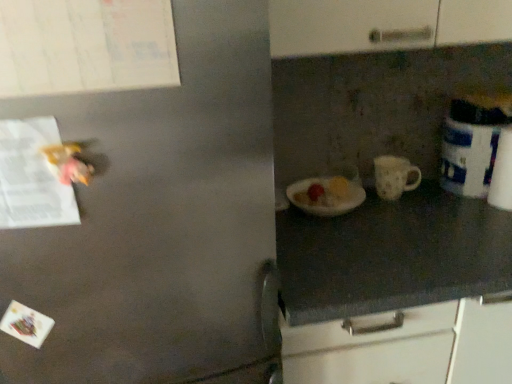
Question: From a real-world perspective, is white matte mug at center above or below white paper at left?

Choices:
 (A) below
 (B) above

Answer: (A)

Question: Does point (380, 195) appear closer or farther from the camera than point (0, 190)?

Choices:
 (A) closer
 (B) farther

Answer: (B)

Question: Which is nearer to the white paper at left?

Choices:
 (A) white glossy canister at right
 (B) white matte mug at center

Answer: (B)

Question: Which of these objects is positioned farthest from the white matte mug at center?

Choices:
 (A) white paper at left
 (B) white glossy canister at right

Answer: (A)